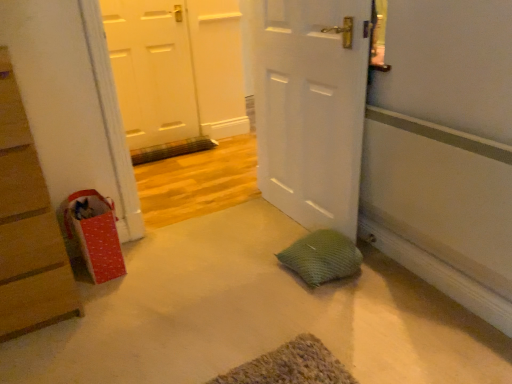
Where is `vacant space that's between green mesh pillow at center and red dotted paper bag at left`? vacant space that's between green mesh pillow at center and red dotted paper bag at left is located at coordinates (202, 266).